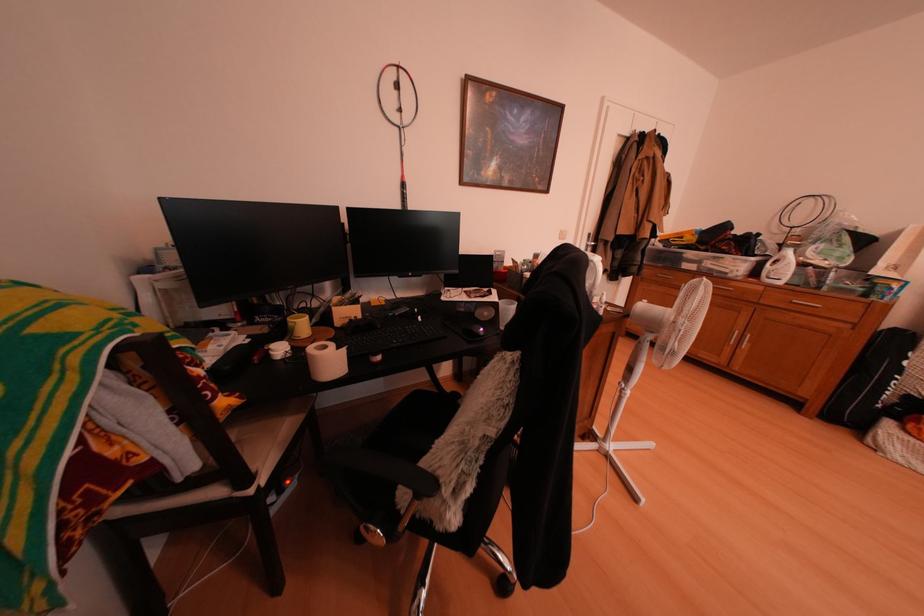
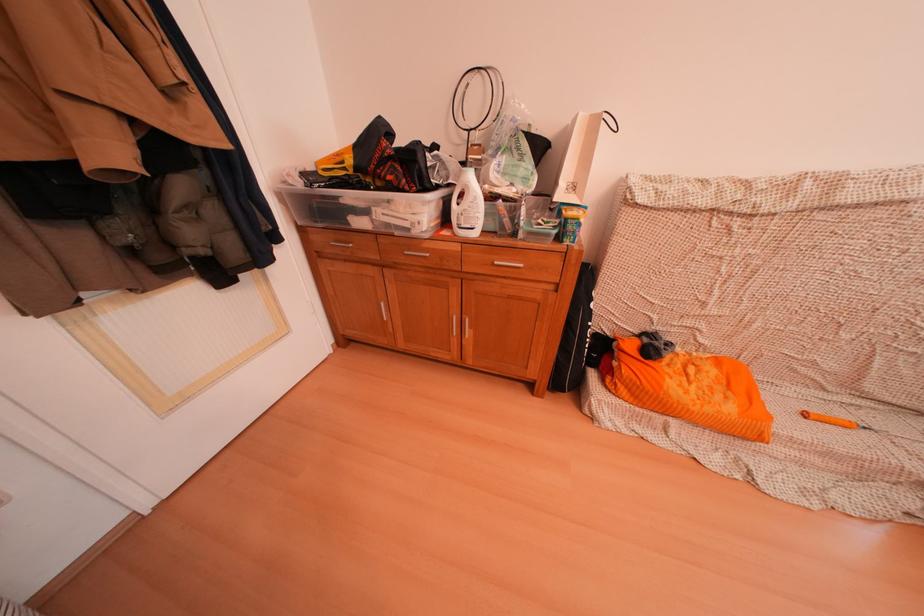
Find the pixel in the second image that matches (x=767, y=261) in the first image.

(450, 192)